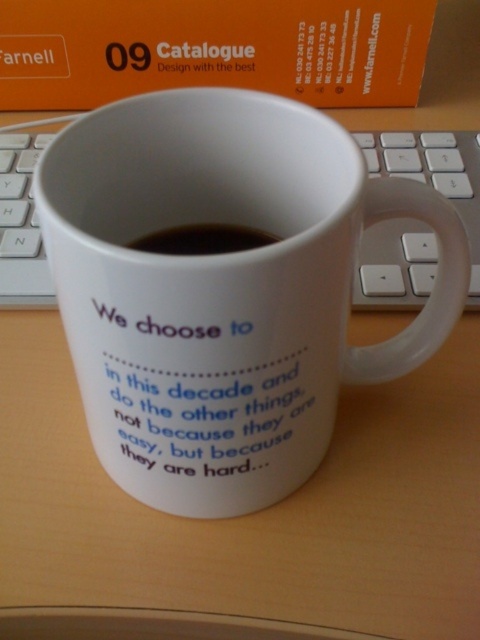
Question: In this image, where is orange paper at upper center located relative to white matte text at center?

Choices:
 (A) below
 (B) above

Answer: (B)

Question: Which object is farther from the camera taking this photo?

Choices:
 (A) white plastic keyboard at center
 (B) black liquid at center
 (C) white ceramic mug at center

Answer: (A)

Question: Which of these objects is positioned farthest from the white ceramic mug at center?

Choices:
 (A) white matte text at center
 (B) black liquid at center

Answer: (B)

Question: Which point is closer to the camera?

Choices:
 (A) white ceramic mug at center
 (B) black liquid at center

Answer: (A)

Question: In this image, where is white matte text at center located relative to white plastic keyboard at center?

Choices:
 (A) right
 (B) left

Answer: (B)

Question: Does white plastic keyboard at center have a greater width compared to black liquid at center?

Choices:
 (A) yes
 (B) no

Answer: (A)